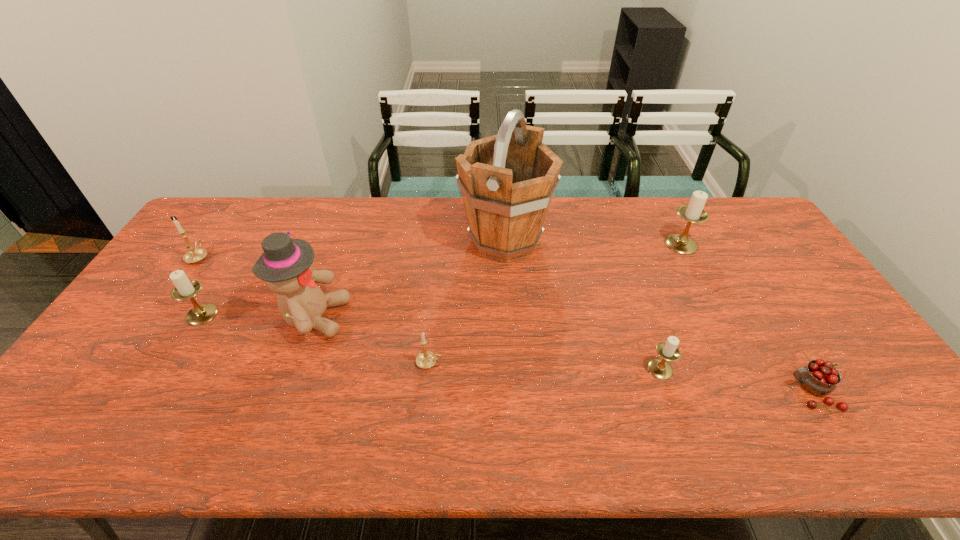
Where is `the fourth object from right to left`? the fourth object from right to left is located at coordinates (507, 180).

Locate an element on the screen. bucket is located at coordinates (507, 180).

Where is `rag_doll`? rag_doll is located at coordinates (286, 265).

Identify the location of the second tallest object. Image resolution: width=960 pixels, height=540 pixels. (286, 265).

Find the location of a particular element. This screenshot has width=960, height=540. the rightmost white candle holder is located at coordinates (693, 213).

Locate an element on the screen. This screenshot has width=960, height=540. the third tallest object is located at coordinates (693, 213).

Find the location of a particular element. The image size is (960, 540). the bigger gold candle holder is located at coordinates (196, 254).

Where is `the leftmost candle holder`? This screenshot has width=960, height=540. the leftmost candle holder is located at coordinates (196, 254).

What are the coordinates of `the second nearest white candle holder` in the screenshot? It's located at click(x=184, y=288).

Where is `the leftmost white candle holder`? The height and width of the screenshot is (540, 960). the leftmost white candle holder is located at coordinates (184, 288).